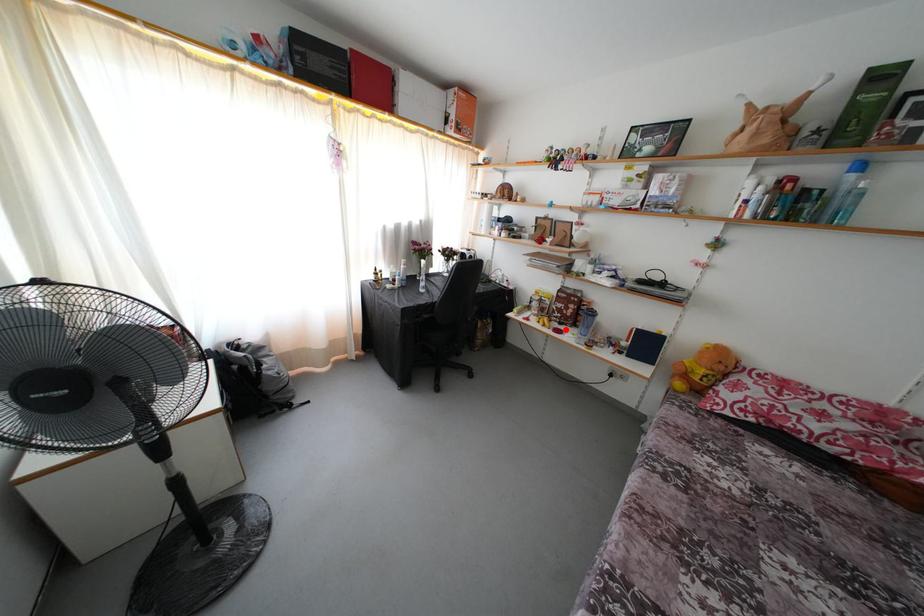
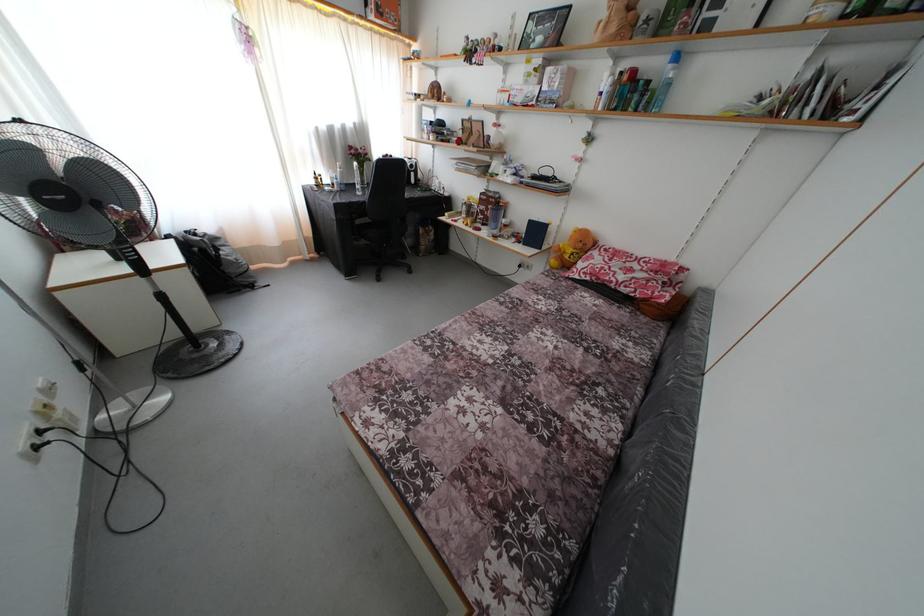
Question: I am providing you with two images of the same scene from different viewpoints. Given a red point in image1, look at the same physical point in image2. Is it:

Choices:
 (A) Closer to the viewpoint
 (B) Farther from the viewpoint

Answer: (A)